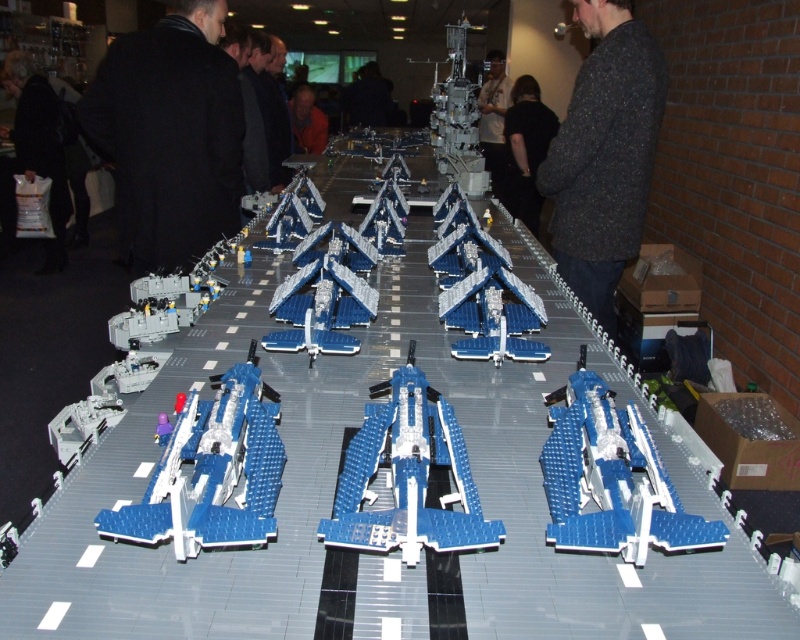
Question: Can you confirm if speckled dark gray sweater at upper center is positioned to the right of dark gray sweater at center?

Choices:
 (A) no
 (B) yes

Answer: (A)

Question: Does black coat at left appear on the left side of black fabric at center?

Choices:
 (A) yes
 (B) no

Answer: (A)

Question: Can you confirm if black coat at left is smaller than black fabric at center?

Choices:
 (A) yes
 (B) no

Answer: (A)

Question: Which of the following is the farthest from the observer?

Choices:
 (A) (172, 28)
 (B) (518, 200)
 (C) (496, 141)

Answer: (C)

Question: Which point is farther from the camera taking this photo?

Choices:
 (A) (206, 58)
 (B) (490, 168)
 (C) (512, 208)
 (D) (596, 195)

Answer: (B)

Question: Which point is closer to the camera?

Choices:
 (A) (610, 6)
 (B) (164, 109)
 (C) (488, 72)
 (D) (526, 221)

Answer: (A)